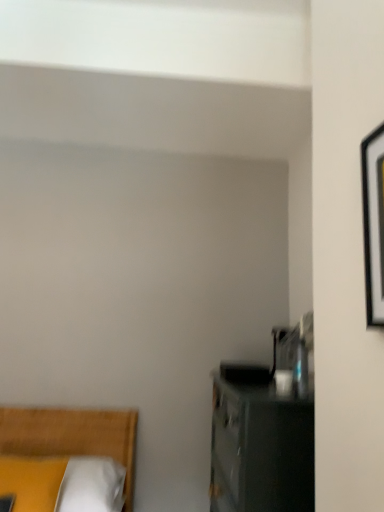
Question: Considering the positions of yellow fabric pillow at lower left and black matte picture frame at right in the image, is yellow fabric pillow at lower left bigger or smaller than black matte picture frame at right?

Choices:
 (A) big
 (B) small

Answer: (A)

Question: In the image, is yellow fabric pillow at lower left on the left side or the right side of black matte picture frame at right?

Choices:
 (A) left
 (B) right

Answer: (A)

Question: Which object is positioned farthest from the yellow fabric bed at lower left?

Choices:
 (A) yellow fabric pillow at lower left
 (B) black matte picture frame at right

Answer: (B)

Question: Estimate the real-world distances between objects in this image. Which object is farther from the black matte picture frame at right?

Choices:
 (A) yellow fabric bed at lower left
 (B) yellow fabric pillow at lower left

Answer: (A)